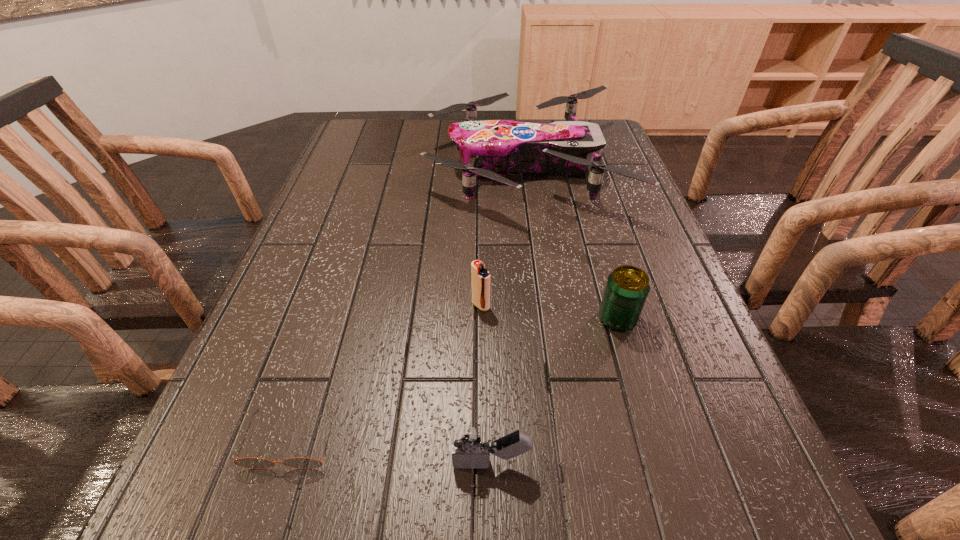
Locate an element on the screen. The width and height of the screenshot is (960, 540). free space between the farther igniter and the farthest object is located at coordinates (502, 237).

Image resolution: width=960 pixels, height=540 pixels. What are the coordinates of `free space between the farther igniter and the nearer igniter` in the screenshot? It's located at (486, 384).

Locate an element on the screen. object that is the third closest to the nearer igniter is located at coordinates (480, 276).

Identify the location of object that is the closest to the beer can. This screenshot has height=540, width=960. (480, 276).

Locate an element on the screen. free point that satisfies the following two spatial constraints: 1. on the front side of the nearer igniter; 2. on the left side of the farther igniter is located at coordinates click(481, 463).

At what (x,y) coordinates should I click in order to perform the action: click on vacant area that satisfies the following two spatial constraints: 1. on the front-facing side of the drone; 2. on the face of the shortest object. Please return your answer as a coordinate pair (x, y). Image resolution: width=960 pixels, height=540 pixels. Looking at the image, I should click on (561, 440).

Locate an element on the screen. This screenshot has width=960, height=540. vacant position in the image that satisfies the following two spatial constraints: 1. on the front-facing side of the beer can; 2. on the left side of the farthest object is located at coordinates (544, 319).

Locate an element on the screen. The image size is (960, 540). vacant space that satisfies the following two spatial constraints: 1. on the front-facing side of the farthest object; 2. on the face of the leftmost object is located at coordinates (561, 440).

This screenshot has width=960, height=540. Identify the location of free spot that satisfies the following two spatial constraints: 1. on the front-facing side of the farthest object; 2. on the left side of the beer can. (544, 319).

Where is `vacant position in the image that satisfies the following two spatial constraints: 1. on the face of the sunglasses; 2. on the left side of the nearer igniter`? vacant position in the image that satisfies the following two spatial constraints: 1. on the face of the sunglasses; 2. on the left side of the nearer igniter is located at coordinates (284, 463).